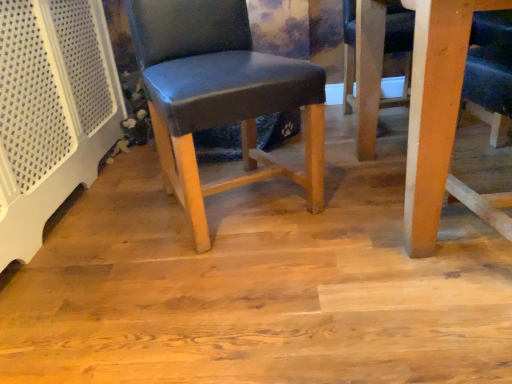
Question: Does matte blue leather chair at center have a greater height compared to matte wood floor at center?

Choices:
 (A) yes
 (B) no

Answer: (A)

Question: Is matte blue leather chair at center further to camera compared to matte wood floor at center?

Choices:
 (A) yes
 (B) no

Answer: (A)

Question: Does matte blue leather chair at center appear on the right side of matte wood floor at center?

Choices:
 (A) no
 (B) yes

Answer: (A)

Question: Considering the relative sizes of matte blue leather chair at center and matte wood floor at center in the image provided, is matte blue leather chair at center thinner than matte wood floor at center?

Choices:
 (A) no
 (B) yes

Answer: (B)

Question: Considering the relative sizes of matte blue leather chair at center and matte wood floor at center in the image provided, is matte blue leather chair at center bigger than matte wood floor at center?

Choices:
 (A) no
 (B) yes

Answer: (B)

Question: Can you confirm if matte blue leather chair at center is smaller than matte wood floor at center?

Choices:
 (A) no
 (B) yes

Answer: (A)

Question: Considering the relative sizes of matte wood floor at center and wooden table at lower right in the image provided, is matte wood floor at center wider than wooden table at lower right?

Choices:
 (A) no
 (B) yes

Answer: (B)

Question: Is matte wood floor at center further to camera compared to wooden table at lower right?

Choices:
 (A) no
 (B) yes

Answer: (B)

Question: Is matte wood floor at center not within wooden table at lower right?

Choices:
 (A) yes
 (B) no

Answer: (A)

Question: From a real-world perspective, is matte wood floor at center physically below wooden table at lower right?

Choices:
 (A) no
 (B) yes

Answer: (B)

Question: Can you see matte wood floor at center touching wooden table at lower right?

Choices:
 (A) yes
 (B) no

Answer: (B)

Question: From the image's perspective, is matte wood floor at center beneath wooden table at lower right?

Choices:
 (A) no
 (B) yes

Answer: (B)

Question: From the image's perspective, would you say wooden table at lower right is shown under matte wood floor at center?

Choices:
 (A) yes
 (B) no

Answer: (B)